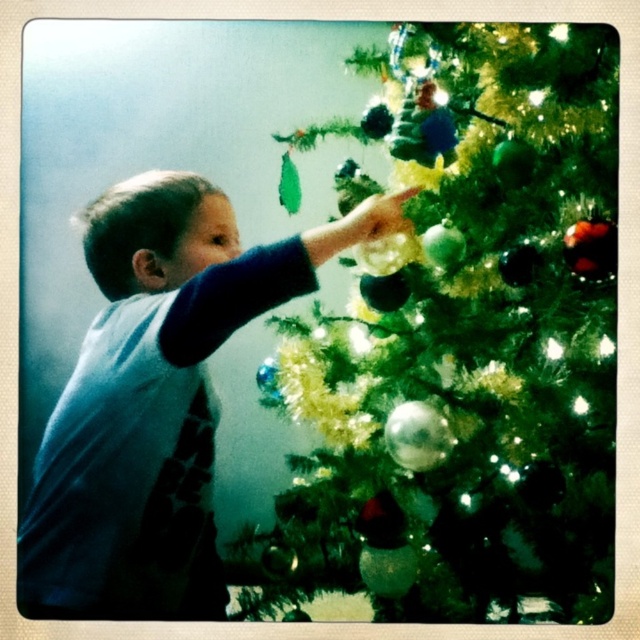
Between green matte christmas tree at upper right and blue cotton shirt at upper left, which one has more height?

green matte christmas tree at upper right

Which is behind, point (552, 32) or point (168, 376)?

Positioned behind is point (552, 32).

This screenshot has width=640, height=640. What do you see at coordinates (465, 352) in the screenshot?
I see `green matte christmas tree at upper right` at bounding box center [465, 352].

Locate an element on the screen. The width and height of the screenshot is (640, 640). green matte christmas tree at upper right is located at coordinates (465, 352).